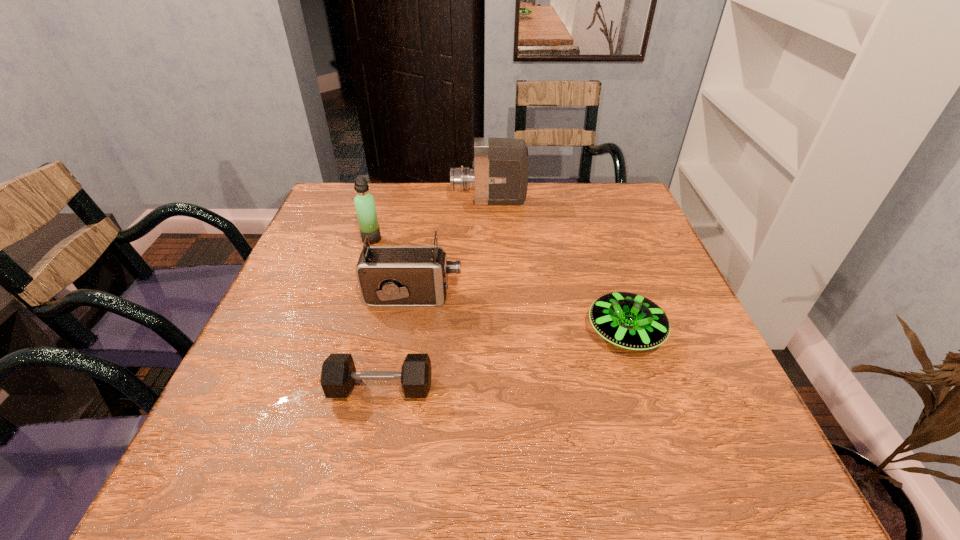
Identify the location of the farther camcorder. (499, 175).

In order to click on the fourth nearest object in this screenshot , I will do `click(364, 202)`.

This screenshot has height=540, width=960. What are the coordinates of `the nearer camcorder` in the screenshot? It's located at (387, 275).

Where is `saucer`? The image size is (960, 540). saucer is located at coordinates (627, 320).

The image size is (960, 540). What are the coordinates of `the nearest object` in the screenshot? It's located at (338, 374).

The width and height of the screenshot is (960, 540). In order to click on free space located at the front of the farthest object, highlighting the lens in this screenshot , I will do point(333,201).

Image resolution: width=960 pixels, height=540 pixels. I want to click on vacant space situated 0.370m at the front of the farthest object, highlighting the lens, so click(x=325, y=201).

The image size is (960, 540). What are the coordinates of `vacant area situated at the front of the farthest object, highlighting the lens` in the screenshot? It's located at (428, 201).

Identify the location of free space located on the right of the thermos bottle. (469, 239).

Where is `free space located 0.400m at the lens of the nearer camcorder`? The width and height of the screenshot is (960, 540). free space located 0.400m at the lens of the nearer camcorder is located at coordinates (640, 296).